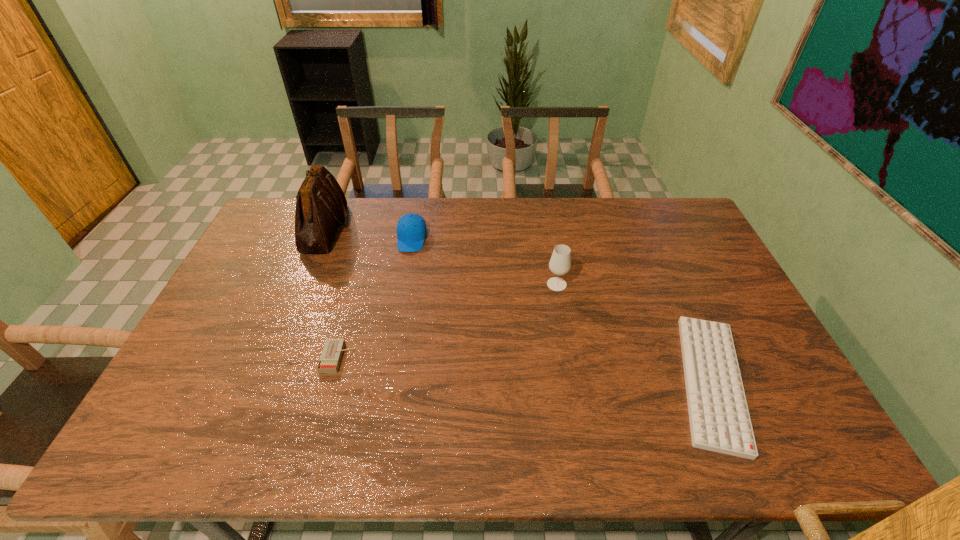
Find the location of a particular element. vacant point located between the second object from left to right and the third tallest object is located at coordinates (375, 298).

Locate an element on the screen. The width and height of the screenshot is (960, 540). vacant space in between the fourth object from left to right and the fourth object from right to left is located at coordinates (447, 321).

The image size is (960, 540). I want to click on free space between the third tallest object and the matchbox, so click(x=375, y=298).

Locate an element on the screen. object identified as the fourth closest to the tallest object is located at coordinates (719, 418).

Identify which object is the third nearest to the shoulder bag. Please provide its 2D coordinates. Your answer should be formatted as a tuple, i.e. [(x, y)], where the tuple contains the x and y coordinates of a point satisfying the conditions above.

[(560, 263)]

This screenshot has height=540, width=960. Find the location of `free location that satisfies the following two spatial constraints: 1. on the front-facing side of the third object from left to right; 2. on the striking surface of the matchbox`. free location that satisfies the following two spatial constraints: 1. on the front-facing side of the third object from left to right; 2. on the striking surface of the matchbox is located at coordinates pyautogui.click(x=391, y=358).

Where is `free point that satisfies the following two spatial constraints: 1. on the back side of the rightmost object; 2. on the striking surface of the matchbox`? This screenshot has height=540, width=960. free point that satisfies the following two spatial constraints: 1. on the back side of the rightmost object; 2. on the striking surface of the matchbox is located at coordinates (702, 358).

Identify the location of vacant space that satisfies the following two spatial constraints: 1. on the front side of the glass; 2. on the right side of the tallest object. (302, 284).

The height and width of the screenshot is (540, 960). In order to click on free space that satisfies the following two spatial constraints: 1. on the front-facing side of the third shortest object; 2. on the striking surface of the fourth object from right to left in this screenshot , I will do `click(391, 358)`.

At what (x,y) coordinates should I click in order to perform the action: click on vacant space that satisfies the following two spatial constraints: 1. on the front-facing side of the third nearest object; 2. on the right side of the third object from left to right. Please return your answer as a coordinate pair (x, y). The height and width of the screenshot is (540, 960). Looking at the image, I should click on (403, 284).